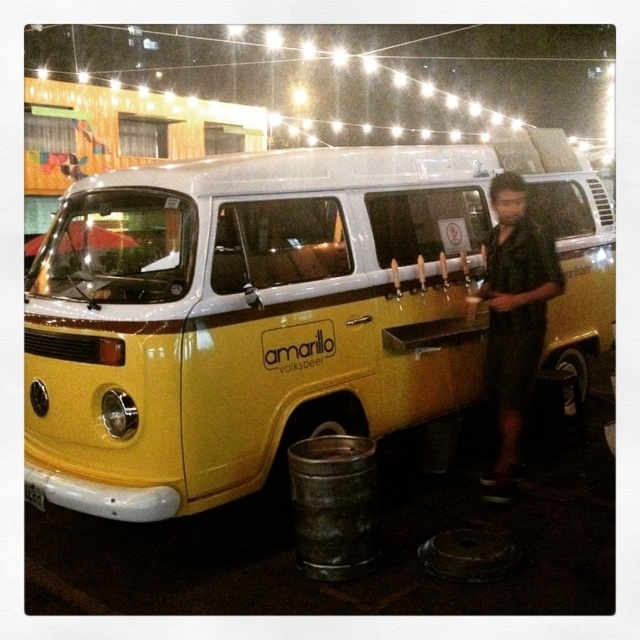
Question: Which point is farther from the camera taking this photo?

Choices:
 (A) (518, 353)
 (B) (588, 317)
 (C) (321, 550)

Answer: (B)

Question: Is dark green shirt at center in front of rusty metal barrel at lower center?

Choices:
 (A) no
 (B) yes

Answer: (A)

Question: Does yellow matte van at center come behind dark green shirt at center?

Choices:
 (A) yes
 (B) no

Answer: (A)

Question: From the image, what is the correct spatial relationship of dark green shirt at center in relation to rusty metal barrel at lower center?

Choices:
 (A) below
 (B) above

Answer: (B)

Question: Which object is closer to the camera taking this photo?

Choices:
 (A) rusty metal barrel at lower center
 (B) dark green shirt at center
 (C) yellow matte van at center

Answer: (A)

Question: Which point is closer to the camera?

Choices:
 (A) dark green shirt at center
 (B) rusty metal barrel at lower center

Answer: (B)